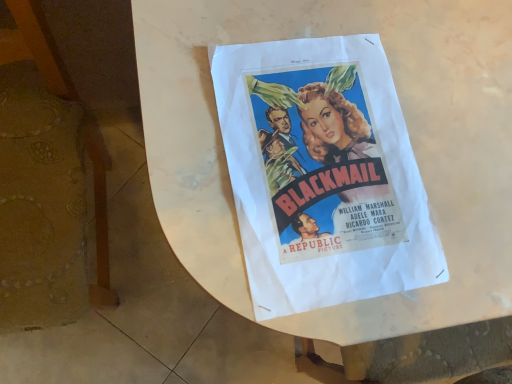
This screenshot has width=512, height=384. Describe the element at coordinates (407, 127) in the screenshot. I see `white paper at center` at that location.

Locate an element on the screen. matte paper poster at center is located at coordinates (322, 174).

I want to click on wooden chair at left, so click(x=46, y=188).

From a real-world perspective, between matte paper poster at center and wooden chair at left, who is vertically higher?

matte paper poster at center is physically above.

Is matte paper poster at center in front of or behind wooden chair at left in the image?

Visually, matte paper poster at center is located behind wooden chair at left.

Is matte paper poster at center to the left of wooden chair at left from the viewer's perspective?

No.

Considering the sizes of objects matte paper poster at center and wooden chair at left in the image provided, who is thinner, matte paper poster at center or wooden chair at left?

With smaller width is matte paper poster at center.

You are a GUI agent. You are given a task and a screenshot of the screen. Output one action in this format:
    pyautogui.click(x=<x>, y=<y>)
    Task: Click on the furniture lying in front of the white paper at center
    This screenshot has height=384, width=512.
    Given the screenshot: What is the action you would take?
    pyautogui.click(x=46, y=188)

Is wooden chair at left taller or shorter than white paper at center?

In the image, wooden chair at left appears to be taller than white paper at center.

How distant is wooden chair at left from white paper at center?

The distance of wooden chair at left from white paper at center is 39.64 centimeters.

How different are the orientations of wooden chair at left and white paper at center in degrees?

2.9 degrees separate the facing orientations of wooden chair at left and white paper at center.

The height and width of the screenshot is (384, 512). Identify the location of poster above the white paper at center (from a real-world perspective). (322, 174).

Considering the sizes of objects matte paper poster at center and white paper at center in the image provided, who is bigger, matte paper poster at center or white paper at center?

Bigger between the two is white paper at center.

In terms of width, does matte paper poster at center look wider or thinner when compared to white paper at center?

matte paper poster at center is thinner than white paper at center.

Looking at this image, which point is more distant from viewer, (335, 298) or (367, 334)?

The point (367, 334) is behind.

Considering the relative sizes of wooden chair at left and matte paper poster at center in the image provided, is wooden chair at left smaller than matte paper poster at center?

Actually, wooden chair at left might be larger than matte paper poster at center.

Is wooden chair at left far away from matte paper poster at center?

No, there isn't a large distance between wooden chair at left and matte paper poster at center.

Can you tell me how much wooden chair at left and matte paper poster at center differ in facing direction?

5.21 degrees separate the facing orientations of wooden chair at left and matte paper poster at center.

This screenshot has width=512, height=384. Identify the location of poster positioned vertically above the wooden chair at left (from a real-world perspective). (322, 174).

Which of these two, white paper at center or matte paper poster at center, is bigger?

white paper at center is bigger.

Is white paper at center further to camera compared to matte paper poster at center?

No, white paper at center is closer to the camera.

Between white paper at center and matte paper poster at center, which one has smaller width?

matte paper poster at center.

Considering the positions of points (478, 269) and (346, 258), is point (478, 269) farther from camera compared to point (346, 258)?

That is True.

Is white paper at center turned away from wooden chair at left?

That's not correct — white paper at center is not looking away from wooden chair at left.

Which point is more forward, [398,31] or [3,168]?

The point [398,31] is closer to the camera.

Who is smaller, white paper at center or wooden chair at left?

With smaller size is wooden chair at left.

Is the depth of white paper at center less than that of wooden chair at left?

No, it is not.

Find the location of a particular element. The width and height of the screenshot is (512, 384). poster located above the wooden chair at left (from a real-world perspective) is located at coordinates (322, 174).

What are the coordinates of `round table that appears below the wooden chair at left (from a real-world perspective)` in the screenshot? It's located at (407, 127).

From the image, which object appears to be farther from wooden chair at left, matte paper poster at center or white paper at center?

The object further to wooden chair at left is matte paper poster at center.

From the image, which object appears to be farther from white paper at center, matte paper poster at center or wooden chair at left?

wooden chair at left is further to white paper at center.

When comparing their distances from wooden chair at left, does white paper at center or matte paper poster at center seem closer?

Based on the image, white paper at center appears to be nearer to wooden chair at left.

When comparing their distances from white paper at center, does wooden chair at left or matte paper poster at center seem closer?

matte paper poster at center is positioned closer to the anchor white paper at center.

In the scene shown: When comparing their distances from matte paper poster at center, does white paper at center or wooden chair at left seem further?

wooden chair at left is further to matte paper poster at center.

From the image, which object appears to be nearer to matte paper poster at center, wooden chair at left or white paper at center?

white paper at center.

Where is `poster situated between wooden chair at left and white paper at center from left to right`? The width and height of the screenshot is (512, 384). poster situated between wooden chair at left and white paper at center from left to right is located at coordinates (322, 174).